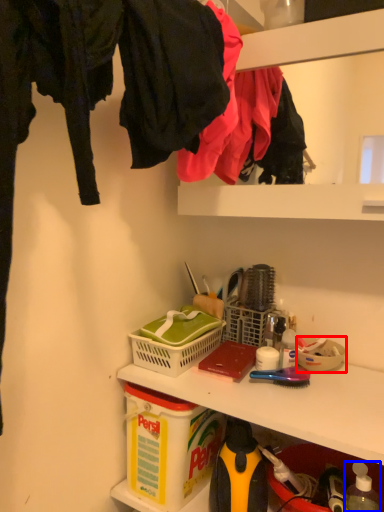
Question: Which point is further to the camera, bowl (highlighted by a red box) or bottle (highlighted by a blue box)?

Choices:
 (A) bowl
 (B) bottle

Answer: (A)